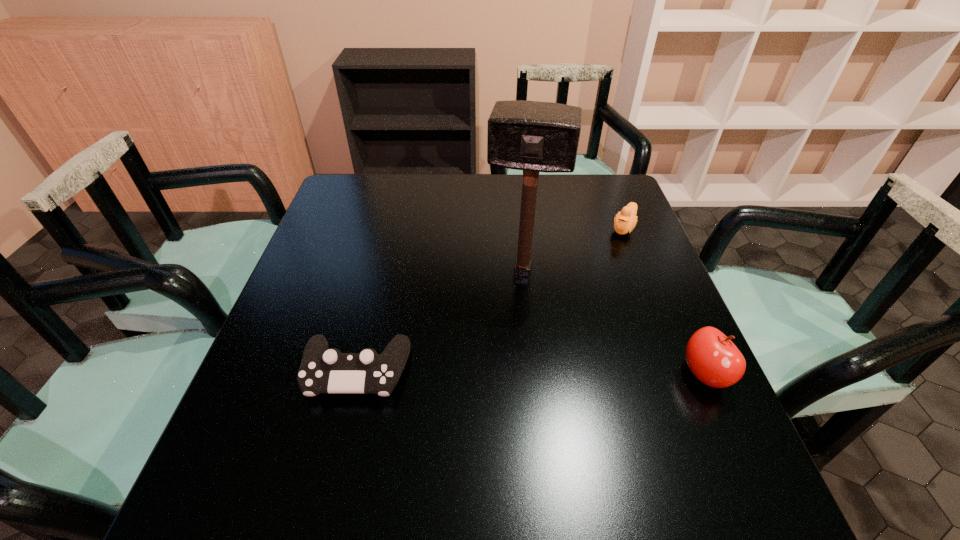
Identify the location of the leftmost object. The width and height of the screenshot is (960, 540). (322, 370).

Identify the location of apple. This screenshot has height=540, width=960. (712, 357).

The image size is (960, 540). I want to click on mallet, so click(x=533, y=136).

Find the location of a particular element. the tallest object is located at coordinates (533, 136).

The image size is (960, 540). I want to click on duckling, so click(625, 221).

This screenshot has width=960, height=540. I want to click on blank area located 0.050m on the head of the second farthest object, so click(515, 302).

You are a GUI agent. You are given a task and a screenshot of the screen. Output one action in this format:
    pyautogui.click(x=<x>, y=<y>)
    Task: Click on the vacant space situated on the head of the second farthest object
    Image resolution: width=960 pixels, height=540 pixels.
    Given the screenshot: What is the action you would take?
    pyautogui.click(x=507, y=341)

The image size is (960, 540). What are the coordinates of `free point located 0.260m on the head of the second farthest object` in the screenshot? It's located at (500, 375).

Where is `free spot located on the face of the duckling`? The image size is (960, 540). free spot located on the face of the duckling is located at coordinates (588, 298).

Identify the location of vacant space located 0.330m on the face of the duckling. The width and height of the screenshot is (960, 540). (579, 314).